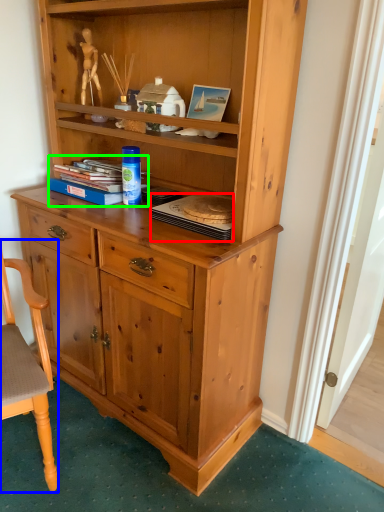
Question: Which object is the closest to the book (highlighted by a red box)? Choose among these: chair (highlighted by a blue box) or book (highlighted by a green box).

Choices:
 (A) chair
 (B) book

Answer: (B)